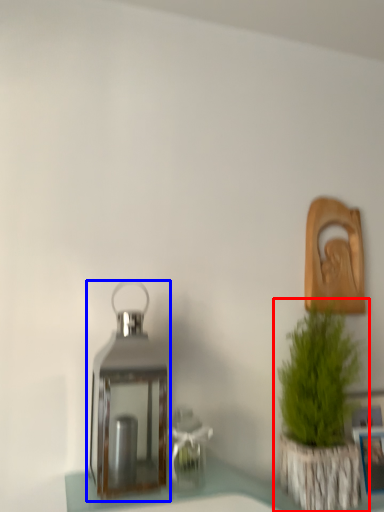
Question: Which point is further to the camera, houseplant (highlighted by a red box) or lantern (highlighted by a blue box)?

Choices:
 (A) houseplant
 (B) lantern

Answer: (A)